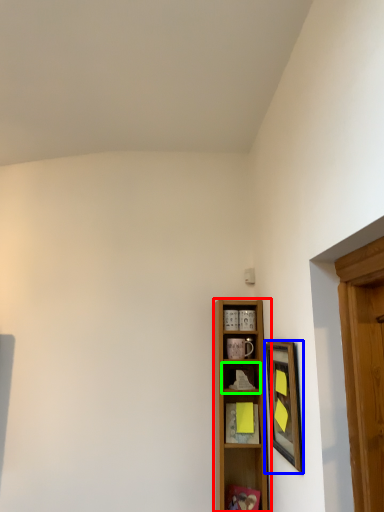
Question: Which object is the farthest from shelf (highlighted by a red box)? Choose among these: picture frame (highlighted by a blue box) or shelf (highlighted by a green box).

Choices:
 (A) picture frame
 (B) shelf

Answer: (A)